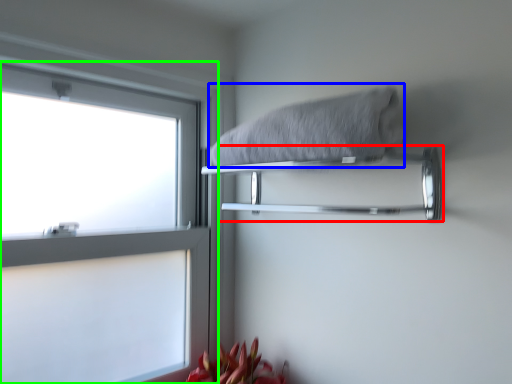
Question: Which object is positioned closest to towel bar (highlighted by a red box)? Select from bath towel (highlighted by a blue box) and window (highlighted by a green box).

Choices:
 (A) bath towel
 (B) window

Answer: (A)